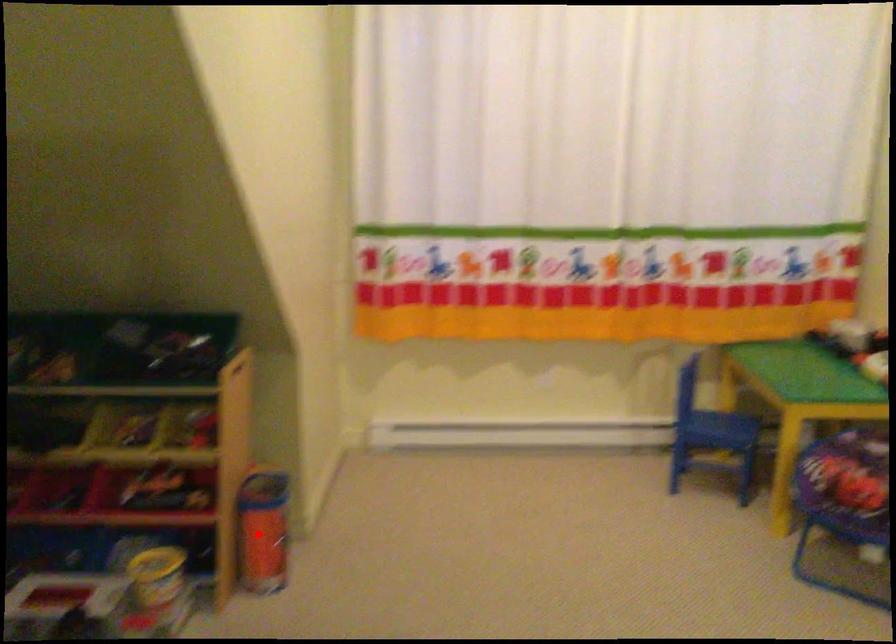
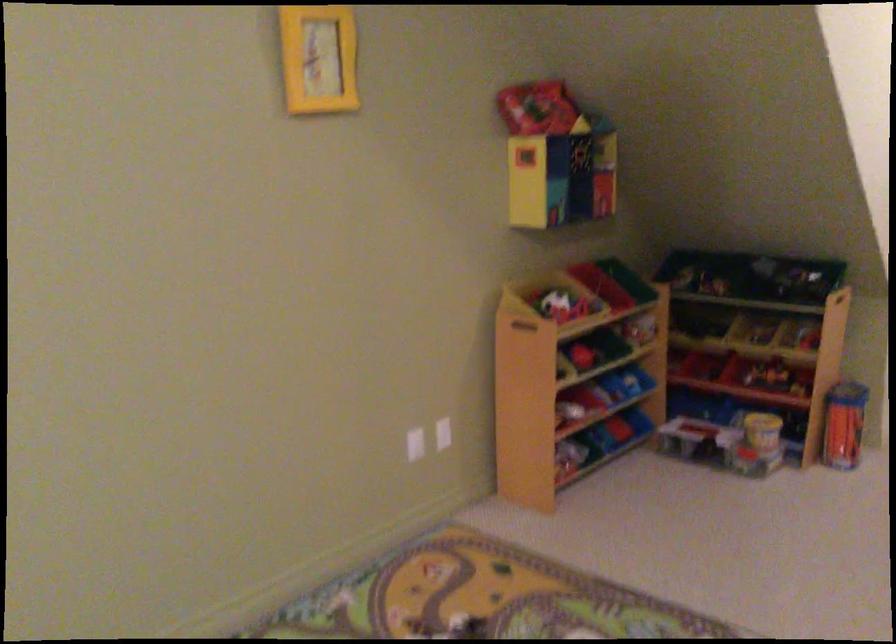
In the second image, find the point that corresponds to the highlighted location in the first image.

(843, 424)